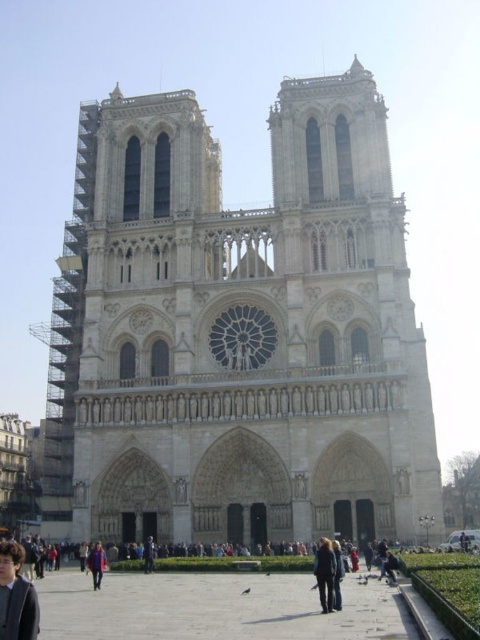
Describe the element at coordinates (15, 596) in the screenshot. This screenshot has width=480, height=640. I see `dark brown hair at lower left` at that location.

Does dark brown hair at lower left have a larger size compared to dark gray fabric coat at center?

Actually, dark brown hair at lower left might be smaller than dark gray fabric coat at center.

Which is in front, point (1, 596) or point (326, 608)?

Point (1, 596) is more forward.

You are a GUI agent. You are given a task and a screenshot of the screen. Output one action in this format:
    pyautogui.click(x=<x>, y=<y>)
    Task: Click on the dark brown hair at lower left
    
    Given the screenshot: What is the action you would take?
    tap(15, 596)

Which is below, white stone tower at center or dark gray fabric coat at center?

dark gray fabric coat at center

Is white stone tower at center positioned before dark gray fabric coat at center?

No, it is behind dark gray fabric coat at center.

Locate an element on the screen. This screenshot has height=640, width=480. white stone tower at center is located at coordinates (238, 332).

In the scene shown: Is dark gray fabric coat at center taller than blue denim jacket at lower center?

Yes.

Looking at this image, can you confirm if dark gray fabric coat at center is wider than blue denim jacket at lower center?

Incorrect, dark gray fabric coat at center's width does not surpass blue denim jacket at lower center's.

Who is more distant from viewer, [322,554] or [96,550]?

Positioned behind is point [96,550].

You are a GUI agent. You are given a task and a screenshot of the screen. Output one action in this format:
    pyautogui.click(x=<x>, y=<y>)
    Task: Click on the dark gray fabric coat at center
    The width and height of the screenshot is (480, 640).
    Given the screenshot: What is the action you would take?
    coord(324,573)